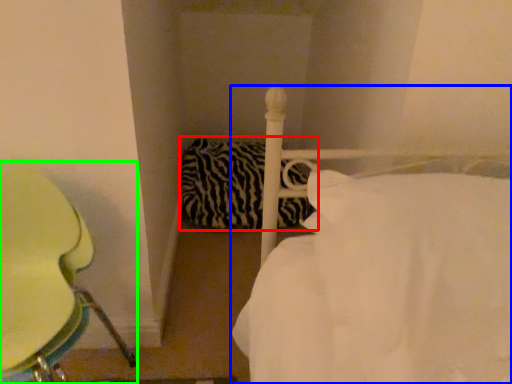
Question: Which object is the farthest from pillow (highlighted by a red box)? Choose among these: bed (highlighted by a blue box) or furniture (highlighted by a green box).

Choices:
 (A) bed
 (B) furniture

Answer: (A)